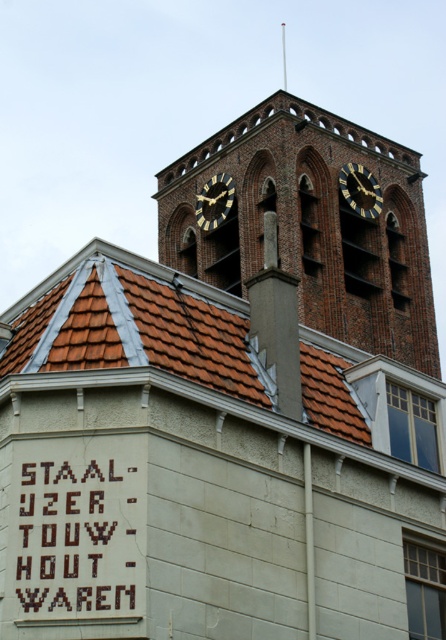
Is brick clock tower at upper center positioned at the back of brown wooden sign at lower left?

Yes, brick clock tower at upper center is behind brown wooden sign at lower left.

Which of these two, brick clock tower at upper center or brown wooden sign at lower left, stands taller?

Standing taller between the two is brick clock tower at upper center.

Is point (254, 141) farther from camera compared to point (19, 547)?

Yes, point (254, 141) is behind point (19, 547).

What are the coordinates of `brick clock tower at upper center` in the screenshot? It's located at (312, 225).

Can you confirm if brown tile roof at upper center is positioned to the right of goldmetallicclock tower at upper center?

In fact, brown tile roof at upper center is to the left of goldmetallicclock tower at upper center.

Is brown tile roof at upper center taller than goldmetallicclock tower at upper center?

Yes, brown tile roof at upper center is taller than goldmetallicclock tower at upper center.

Does point (95, 259) lie behind point (356, 182)?

No, it is not.

The height and width of the screenshot is (640, 446). I want to click on brown tile roof at upper center, so click(132, 324).

Does brick clock tower at upper center have a greater height compared to goldmetallicclock at upper center?

Yes, brick clock tower at upper center is taller than goldmetallicclock at upper center.

Does brick clock tower at upper center have a smaller size compared to goldmetallicclock at upper center?

No.

You are a GUI agent. You are given a task and a screenshot of the screen. Output one action in this format:
    pyautogui.click(x=<x>, y=<y>)
    Task: Click on the brick clock tower at upper center
    The image size is (446, 640).
    Given the screenshot: What is the action you would take?
    pyautogui.click(x=312, y=225)

Find the location of a particular element. brick clock tower at upper center is located at coordinates (312, 225).